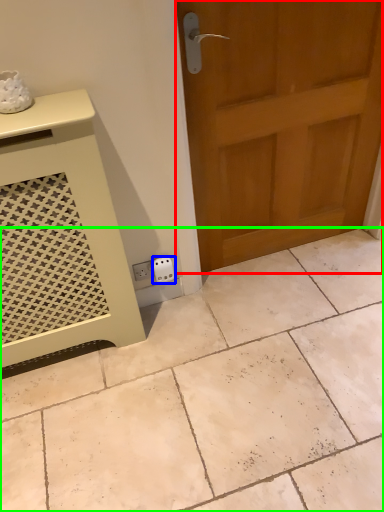
Question: Estimate the real-world distances between objects in this image. Which object is closer to door (highlighted by a red box), electric outlet (highlighted by a blue box) or ceramic tile (highlighted by a green box)?

Choices:
 (A) electric outlet
 (B) ceramic tile

Answer: (A)